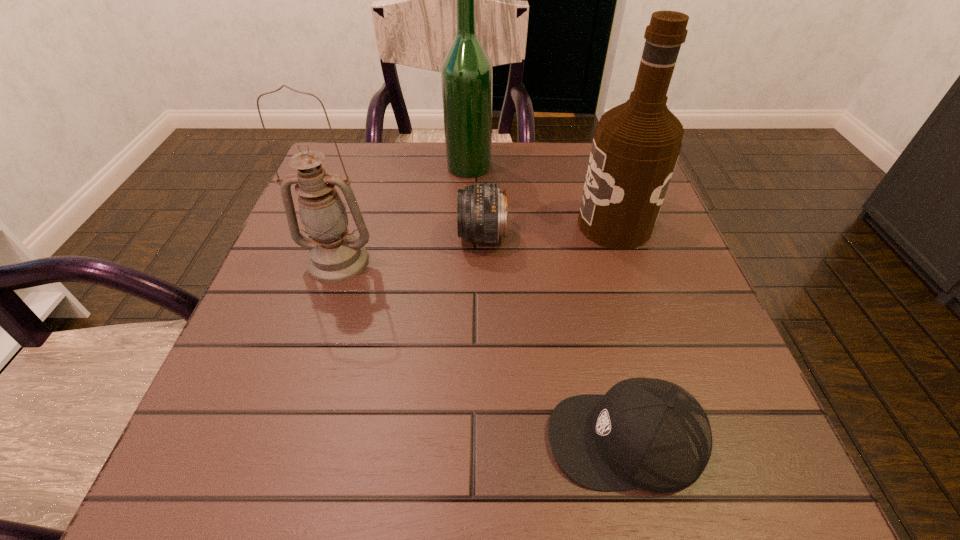
This screenshot has height=540, width=960. I want to click on object located in the near edge section of the desktop, so click(646, 433).

Identify the location of object located at the left edge. (335, 255).

Find the location of a particular element. The height and width of the screenshot is (540, 960). alcohol that is at the right edge is located at coordinates (635, 148).

This screenshot has width=960, height=540. I want to click on cap present at the right edge, so click(x=646, y=433).

You are a GUI agent. You are given a task and a screenshot of the screen. Output one action in this format:
    pyautogui.click(x=<x>, y=<y>)
    Task: Click on the object that is at the near right corner
    
    Given the screenshot: What is the action you would take?
    pyautogui.click(x=646, y=433)

In the image, there is a desktop. At what (x,y) coordinates should I click in order to perform the action: click on free region at the far edge. Please return your answer as a coordinate pair (x, y). This screenshot has width=960, height=540. Looking at the image, I should click on (543, 185).

You are a GUI agent. You are given a task and a screenshot of the screen. Output one action in this format:
    pyautogui.click(x=<x>, y=<y>)
    Task: Click on the vacant space at the near edge
    Image resolution: width=960 pixels, height=540 pixels.
    Given the screenshot: What is the action you would take?
    pyautogui.click(x=429, y=462)

I want to click on vacant space at the left edge of the desktop, so click(x=250, y=335).

Identify the location of free location at the right edge of the desktop. (629, 278).

Where is `blank space at the far left corner of the desktop`? The image size is (960, 540). blank space at the far left corner of the desktop is located at coordinates (329, 166).